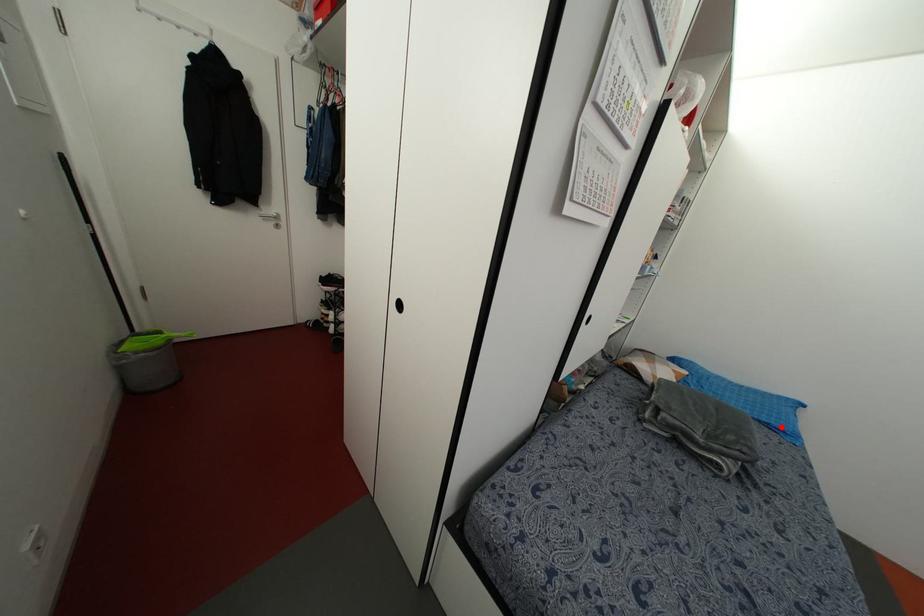
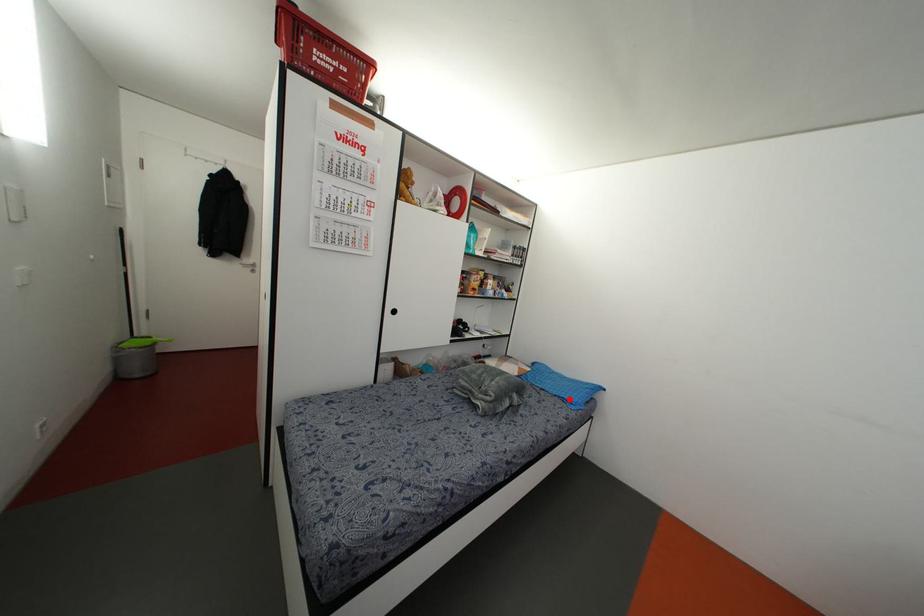
I am providing you with two images of the same scene from different viewpoints. A red point is marked on the first image and another point is marked on the second image. Does the point marked in image1 correspond to the same location as the one in image2?

Yes